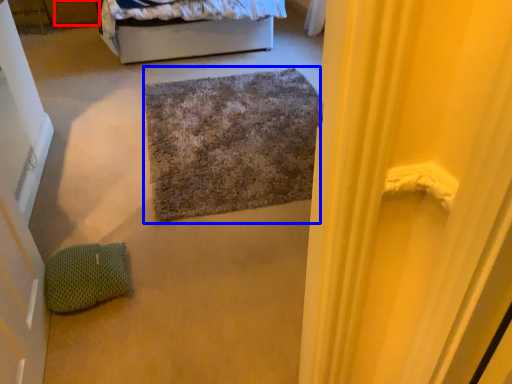
Question: Which object is closer to the camera taking this photo, drawer (highlighted by a red box) or doormat (highlighted by a blue box)?

Choices:
 (A) drawer
 (B) doormat

Answer: (B)